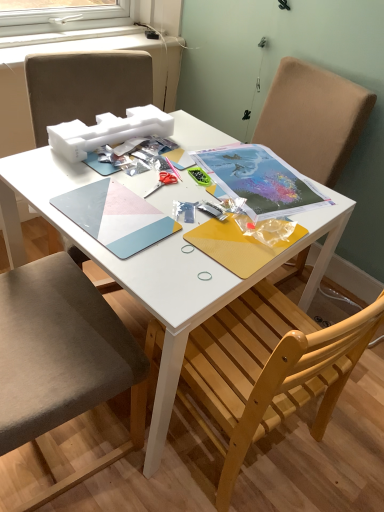
Question: Is matte paper notebook at center, the 1th notebook from the right, taller or shorter than metallic silver scissors at center?

Choices:
 (A) tall
 (B) short

Answer: (A)

Question: Is matte paper notebook at center, the 1th notebook from the right, inside or outside of metallic silver scissors at center?

Choices:
 (A) inside
 (B) outside

Answer: (B)

Question: Which is farther from the fabric cushioned chair at left, which appears as the second chair when viewed from the right?

Choices:
 (A) matte paper notebook at center, the 1th notebook from the right
 (B) metallic silver scissors at center
 (C) wooden chair at lower right, which is the 1th chair from right to left
 (D) matte plastic notebook at center, which ranks as the 1th notebook in left-to-right order

Answer: (C)

Question: Estimate the real-world distances between objects in this image. Which object is farther from the matte plastic notebook at center, the 2th notebook when ordered from right to left?

Choices:
 (A) fabric cushioned chair at left, which ranks as the first chair in left-to-right order
 (B) matte paper notebook at center, which is the second notebook from left to right
 (C) metallic silver scissors at center
 (D) wooden chair at lower right, which is the 1th chair from right to left

Answer: (D)